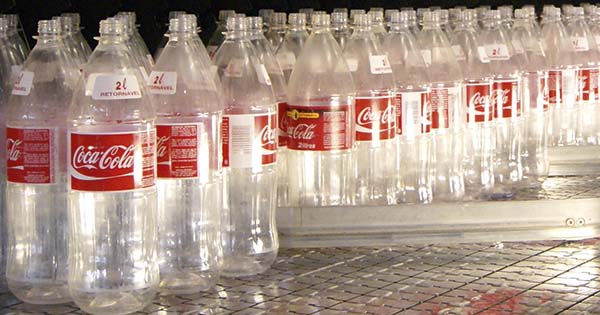
Identify the location of 2nd fully visible bottle from the left. (86, 119).